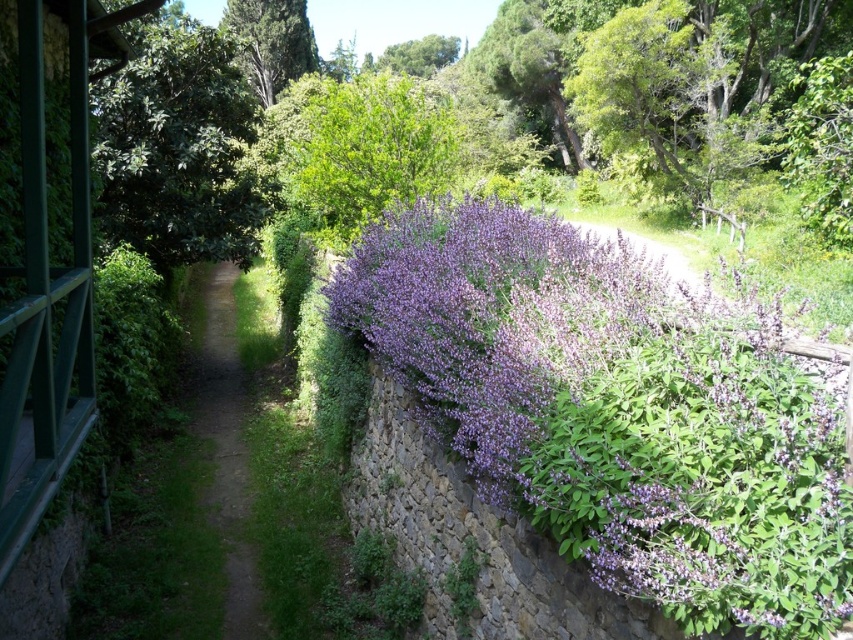
Who is higher up, purple leafy bush at center or dirt path at center?

purple leafy bush at center

Measure the distance from purple leafy bush at center to dirt path at center.

They are 4.61 meters apart.

What do you see at coordinates (614, 412) in the screenshot? This screenshot has width=853, height=640. I see `purple leafy bush at center` at bounding box center [614, 412].

Find the location of a particular element. The image size is (853, 640). purple leafy bush at center is located at coordinates pos(614,412).

Does point (160, 92) lie behind point (206, 390)?

No, it is in front of (206, 390).

Does green leafy tree at upper left have a smaller size compared to dirt path at center?

Correct, green leafy tree at upper left occupies less space than dirt path at center.

The width and height of the screenshot is (853, 640). What are the coordinates of `green leafy tree at upper left` in the screenshot? It's located at (178, 147).

Can you confirm if green leafy tree at upper left is smaller than green textured tree at upper center?

Yes, green leafy tree at upper left is smaller than green textured tree at upper center.

Is green leafy tree at upper left shorter than green textured tree at upper center?

Correct, green leafy tree at upper left is not as tall as green textured tree at upper center.

Is point (102, 192) farther from camera compared to point (299, 16)?

No, it is in front of (299, 16).

Find the location of a particular element. The image size is (853, 640). green leafy tree at upper left is located at coordinates (178, 147).